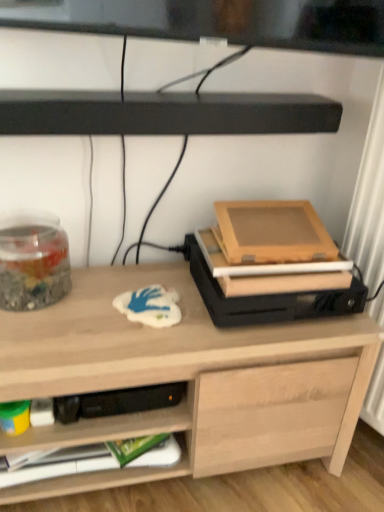
Where is `empty space that is ontop of light wood desk at center (from a real-world perspective)`? This screenshot has height=512, width=384. empty space that is ontop of light wood desk at center (from a real-world perspective) is located at coordinates (126, 308).